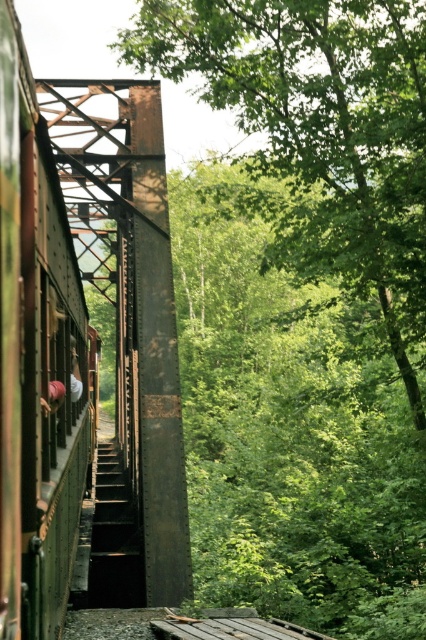
Question: From the image, what is the correct spatial relationship of green matte train at left in relation to rusty metal stairs at center?

Choices:
 (A) below
 (B) above

Answer: (B)

Question: Which of the following is the farthest from the observer?

Choices:
 (A) (121, 532)
 (B) (66, 468)

Answer: (A)

Question: Can you confirm if green matte train at left is positioned to the left of rusty metal stairs at center?

Choices:
 (A) yes
 (B) no

Answer: (B)

Question: Which point is farther to the camera?

Choices:
 (A) (103, 595)
 (B) (423, 269)

Answer: (A)

Question: Does green leafy tree at center appear over green matte train at left?

Choices:
 (A) yes
 (B) no

Answer: (A)

Question: Which object is closer to the camera taking this photo?

Choices:
 (A) green leafy tree at center
 (B) rusty metal stairs at center
 (C) rusty metal train bridge at center

Answer: (C)